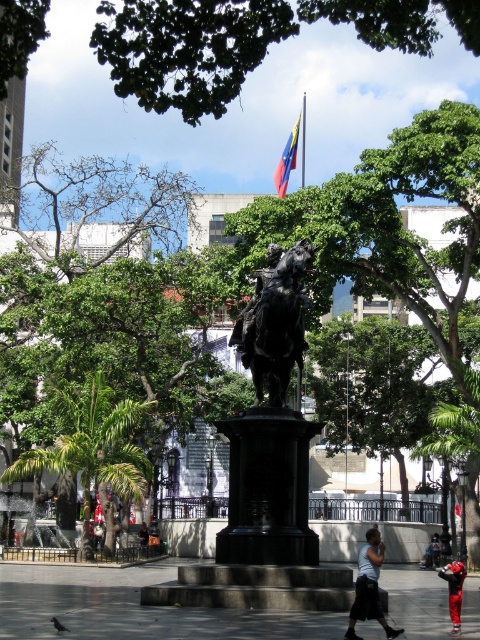
Question: Based on their relative distances, which object is nearer to the black polished statue at center?

Choices:
 (A) green leafy tree at left
 (B) bronze statue at center

Answer: (B)

Question: Is green leafy tree at center below light blue t-shirt at lower right?

Choices:
 (A) yes
 (B) no

Answer: (B)

Question: Can you confirm if green leafy tree at upper center is positioned below dark blue jeans at center?

Choices:
 (A) yes
 (B) no

Answer: (B)

Question: Is red fabric pants at lower right above red fabric flag at upper center?

Choices:
 (A) no
 (B) yes

Answer: (A)

Question: Which point is closer to the camera?

Choices:
 (A) bronze statue at center
 (B) red fabric pants at lower right
 (C) red fabric flag at upper center

Answer: (B)

Question: Which is farther from the red fabric flag at upper center?

Choices:
 (A) green leafy tree at upper center
 (B) bronze statue at center
 (C) light blue t-shirt at lower right
 (D) black polished statue at center

Answer: (C)